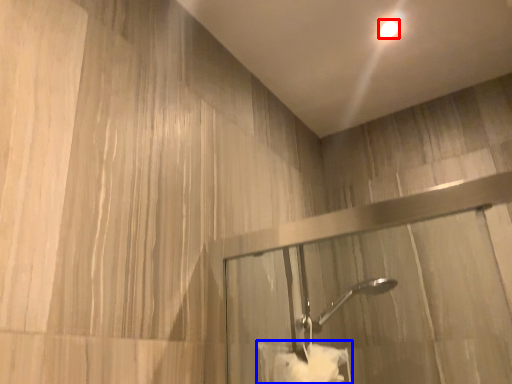
Question: Among these objects, which one is nearest to the camera, droplight (highlighted by a red box) or bath towel (highlighted by a blue box)?

Choices:
 (A) droplight
 (B) bath towel

Answer: (B)